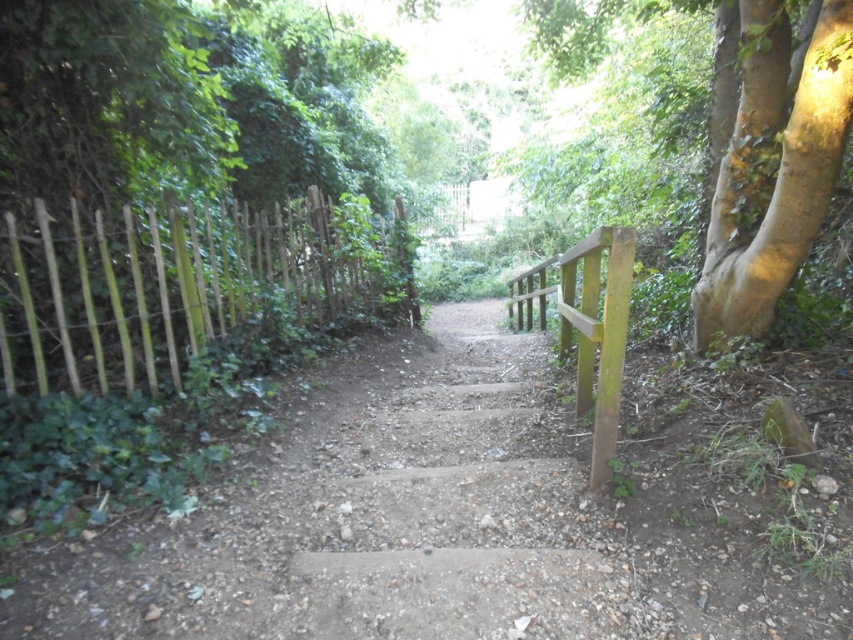
Which of these two, green rough bark tree at right or green wood rail at right, stands shorter?

Standing shorter between the two is green wood rail at right.

What do you see at coordinates (769, 154) in the screenshot? This screenshot has width=853, height=640. I see `green rough bark tree at right` at bounding box center [769, 154].

Does point (724, 196) lie in front of point (602, 477)?

That is False.

The height and width of the screenshot is (640, 853). I want to click on green rough bark tree at right, so click(769, 154).

Is wooden picket fence at left thinner than green rough bark tree at right?

No, wooden picket fence at left is not thinner than green rough bark tree at right.

Which is more to the left, wooden picket fence at left or green rough bark tree at right?

Positioned to the left is wooden picket fence at left.

The image size is (853, 640). Find the location of `wooden picket fence at left`. wooden picket fence at left is located at coordinates (189, 284).

The image size is (853, 640). Find the location of `wooden picket fence at left`. wooden picket fence at left is located at coordinates (189, 284).

Does wooden picket fence at left appear on the left side of green wood rail at right?

Correct, you'll find wooden picket fence at left to the left of green wood rail at right.

Is point (202, 269) farther from camera compared to point (509, 300)?

No, it is in front of (509, 300).

What do you see at coordinates (189, 284) in the screenshot?
I see `wooden picket fence at left` at bounding box center [189, 284].

Where is `wooden picket fence at left`? This screenshot has height=640, width=853. wooden picket fence at left is located at coordinates (189, 284).